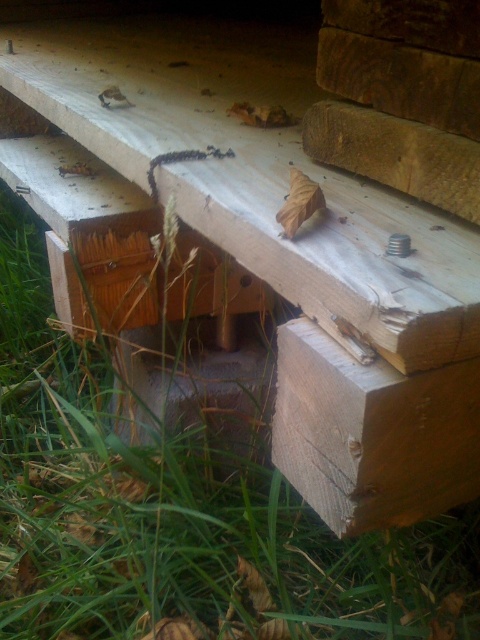
Question: Which of the following is the closest to the observer?

Choices:
 (A) (434, 496)
 (B) (1, 506)

Answer: (A)

Question: Is green grass at lower left to the right of natural wood plank at lower right from the viewer's perspective?

Choices:
 (A) yes
 (B) no

Answer: (B)

Question: Is green grass at lower left thinner than natural wood at center?

Choices:
 (A) no
 (B) yes

Answer: (A)

Question: Which of the following is the farthest from the observer?

Choices:
 (A) natural wood plank at lower right
 (B) natural wood at center
 (C) green grass at lower left

Answer: (C)

Question: From the image, what is the correct spatial relationship of green grass at lower left in relation to natural wood plank at lower right?

Choices:
 (A) below
 (B) above

Answer: (B)

Question: Which object appears farthest from the camera in this image?

Choices:
 (A) green grass at lower left
 (B) natural wood at center

Answer: (A)